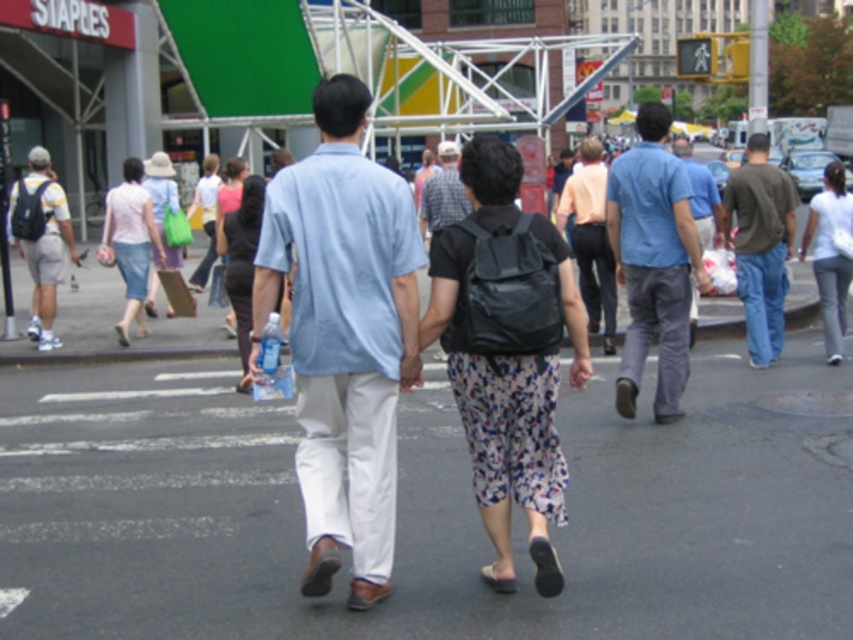
Is dark brown cotton shirt at right shorter than white cotton pants at lower right?

No, dark brown cotton shirt at right is not shorter than white cotton pants at lower right.

Between dark brown cotton shirt at right and white cotton pants at lower right, which one has less height?

white cotton pants at lower right is shorter.

What do you see at coordinates (759, 244) in the screenshot?
I see `dark brown cotton shirt at right` at bounding box center [759, 244].

The width and height of the screenshot is (853, 640). In order to click on dark brown cotton shirt at right in this screenshot , I will do `click(759, 244)`.

Does blue cotton shirt at center have a larger size compared to plaid shirt at center?

Incorrect, blue cotton shirt at center is not larger than plaid shirt at center.

Describe the element at coordinates (653, 260) in the screenshot. I see `blue cotton shirt at center` at that location.

Who is more forward, (656, 124) or (456, 163)?

Point (656, 124) is more forward.

Image resolution: width=853 pixels, height=640 pixels. What are the coordinates of `blue cotton shirt at center` in the screenshot? It's located at (653, 260).

Can you confirm if blue cotton shirt at center is thinner than light pink fabric dress at center?

No, blue cotton shirt at center is not thinner than light pink fabric dress at center.

Which is more to the left, blue cotton shirt at center or light pink fabric dress at center?

From the viewer's perspective, light pink fabric dress at center appears more on the left side.

Describe the element at coordinates (653, 260) in the screenshot. I see `blue cotton shirt at center` at that location.

Image resolution: width=853 pixels, height=640 pixels. Find the location of `blue cotton shirt at center`. blue cotton shirt at center is located at coordinates (653, 260).